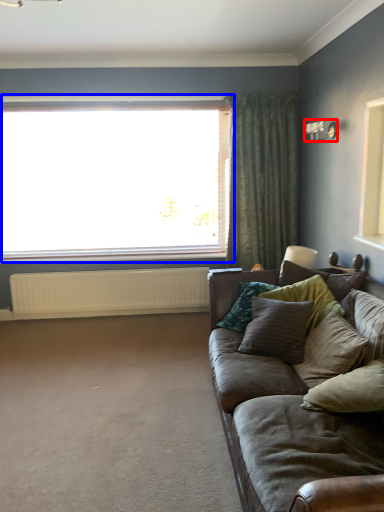
Question: Which point is closer to the camera, light fixture (highlighted by a red box) or window (highlighted by a blue box)?

Choices:
 (A) light fixture
 (B) window

Answer: (A)